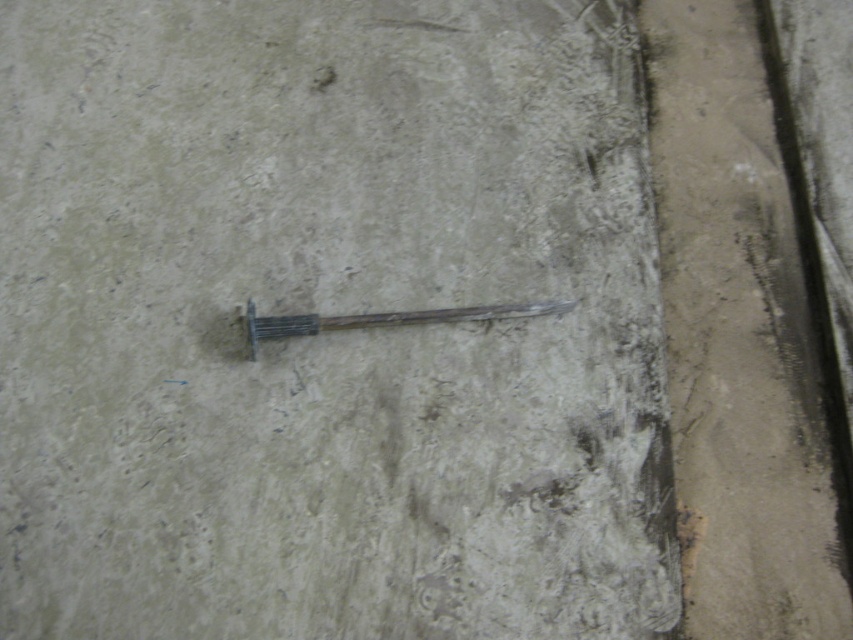
You are a painter who needs to place a ladder against the wall. You see the smooth concrete at right and the wooden stick at center. Which surface would provide a more stable base for the ladder?

The smooth concrete at right is much taller than the wooden stick at center, so it would provide a more stable base for the ladder.

From the picture: You are standing 3 feet away from the camera. Can you reach the smooth concrete at right without moving your feet?

The smooth concrete at right is 3.68 feet away from the camera. Since you are standing 3 feet away from the camera, you are 0.68 feet closer than the smooth concrete at right. Therefore, you can reach the smooth concrete at right without moving your feet.

You are an artist holding a paintbrush. You want to paint on the smooth concrete at right and the wooden stick at center. Which surface will require more paint due to its texture?

The wooden stick at center has a rougher texture compared to the smooth concrete at right, so it will require more paint.